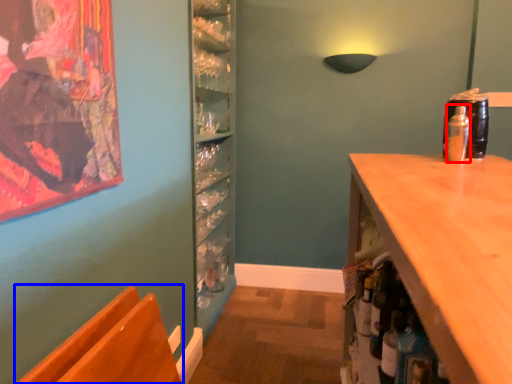
Question: Which object appears farthest to the camera in this image, bottle (highlighted by a red box) or chair (highlighted by a blue box)?

Choices:
 (A) bottle
 (B) chair

Answer: (A)